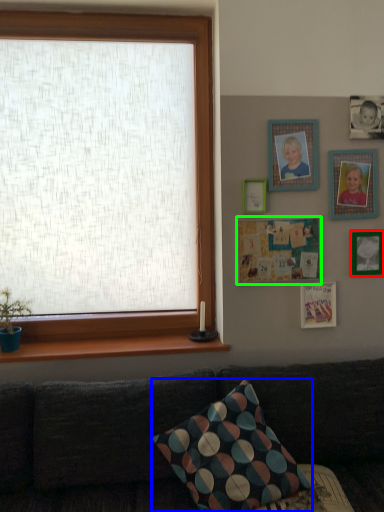
Question: Which object is the closest to the picture frame (highlighted by a red box)? Choose among these: pillow (highlighted by a blue box) or picture frame (highlighted by a green box).

Choices:
 (A) pillow
 (B) picture frame

Answer: (B)